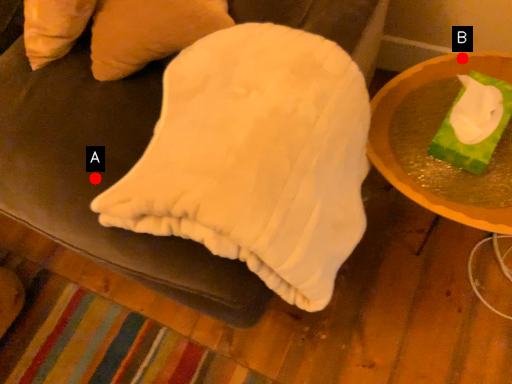
Question: Two points are circled on the image, labeled by A and B beside each circle. Which point is further to the camera?

Choices:
 (A) A is further
 (B) B is further

Answer: (B)